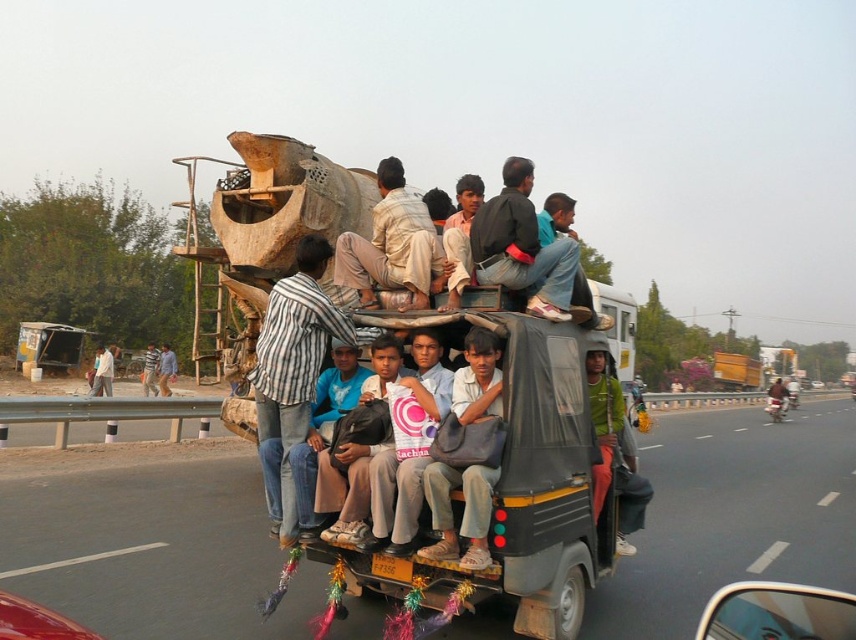
Question: Estimate the real-world distances between objects in this image. Which object is closer to the striped shirt at center?

Choices:
 (A) blue striped shirt at center
 (B) dark blue jeans at center

Answer: (A)

Question: Which of the following is the closest to the observer?

Choices:
 (A) white striped shirt at center
 (B) black rubber road at center
 (C) dark blue jeans at center

Answer: (B)

Question: Can you confirm if striped fabric shirt at center is positioned to the right of shiny red car at lower left?

Choices:
 (A) no
 (B) yes

Answer: (B)

Question: Is shiny red car at lower left positioned behind blue striped shirt at center?

Choices:
 (A) no
 (B) yes

Answer: (A)

Question: Where is white striped shirt at center located in relation to brown leather jacket at center in the image?

Choices:
 (A) right
 (B) left

Answer: (B)

Question: Which point appears closest to the camera in this image?

Choices:
 (A) (125, 614)
 (B) (111, 365)
 (C) (163, 388)

Answer: (A)